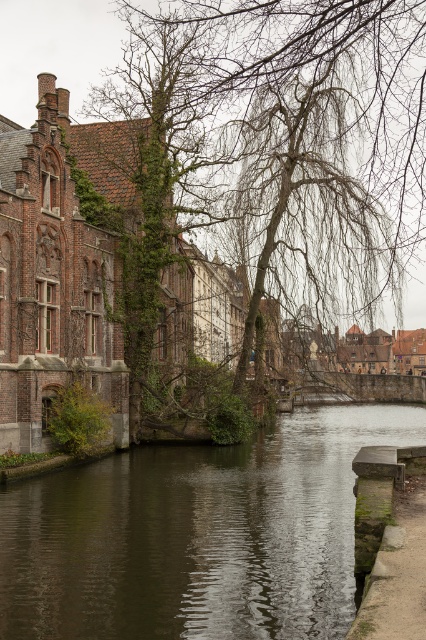
Is dark brown water at center positioned in front of green mossy stone at lower right?

No, it is not.

How much distance is there between dark brown water at center and green mossy stone at lower right?

dark brown water at center is 16.45 meters from green mossy stone at lower right.

This screenshot has height=640, width=426. I want to click on dark brown water at center, so click(196, 536).

You are a GUI agent. You are given a task and a screenshot of the screen. Output one action in this format:
    pyautogui.click(x=<x>, y=<y>)
    Task: Click on the dark brown water at center
    Image resolution: width=426 pixels, height=640 pixels.
    Given the screenshot: What is the action you would take?
    pyautogui.click(x=196, y=536)

Is green ivy-covered tree at left behind dark brown water at center?

Yes.

Does point (422, 19) come farther from viewer compared to point (172, 618)?

Yes, it is behind point (172, 618).

Measure the distance between green ivy-covered tree at left and camera.

A distance of 66.64 meters exists between green ivy-covered tree at left and camera.

Identify the location of green ivy-covered tree at left. (290, 138).

Does green ivy-covered tree at left have a larger size compared to green mossy stone at lower right?

Yes, green ivy-covered tree at left is bigger than green mossy stone at lower right.

Does point (294, 70) come farther from viewer compared to point (411, 592)?

Yes, it is behind point (411, 592).

What do you see at coordinates (290, 138) in the screenshot? This screenshot has height=640, width=426. I see `green ivy-covered tree at left` at bounding box center [290, 138].

Find the location of a particular element. This screenshot has height=640, width=426. green ivy-covered tree at left is located at coordinates (290, 138).